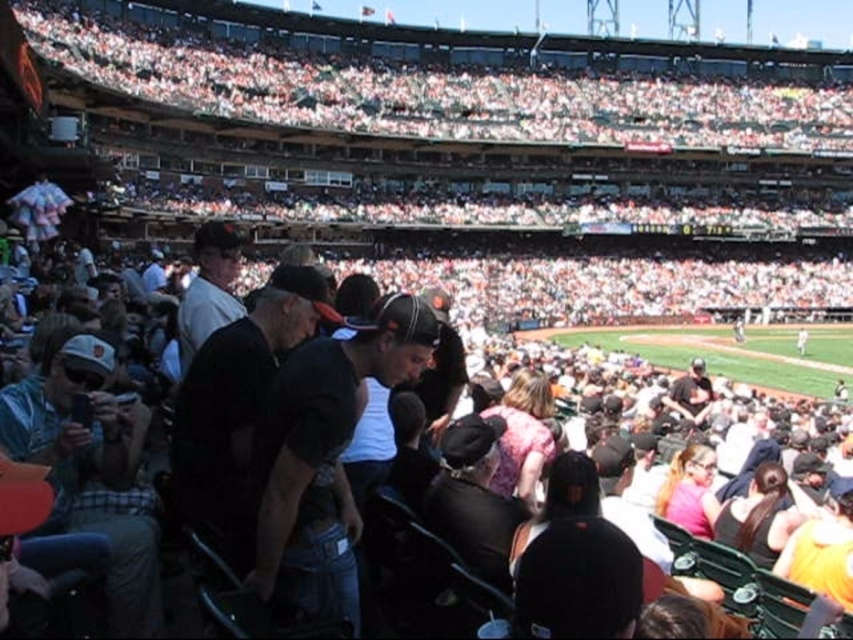
Locate an element on the screen. This screenshot has width=853, height=640. dark gray baseball cap at center is located at coordinates (473, 499).

What do you see at coordinates (473, 499) in the screenshot?
I see `dark gray baseball cap at center` at bounding box center [473, 499].

Where is `dark gray baseball cap at center`? This screenshot has height=640, width=853. dark gray baseball cap at center is located at coordinates (473, 499).

From the picture: Who is lower down, black matte shirt at center or dark gray baseball cap at center?

dark gray baseball cap at center is lower down.

Between point (207, 499) and point (471, 512), which one is positioned behind?

Point (471, 512)

Is point (244, 497) positioned after point (469, 557)?

No, (244, 497) is closer to viewer.

Locate an element on the screen. The width and height of the screenshot is (853, 640). black matte shirt at center is located at coordinates (236, 404).

Which is behind, point (399, 305) or point (138, 403)?

Point (138, 403)

Is point (416, 376) less distant than point (80, 522)?

No, it is behind (80, 522).

The height and width of the screenshot is (640, 853). Find the location of `black cotton shirt at center`. black cotton shirt at center is located at coordinates (325, 456).